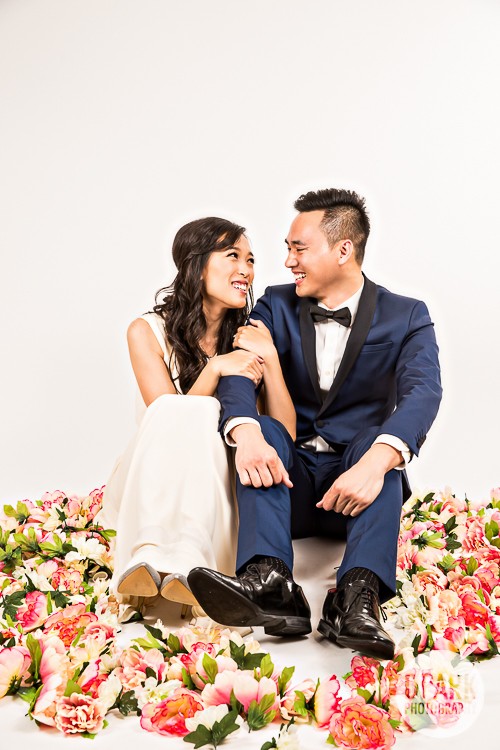
Find the location of `floor`. floor is located at coordinates (312, 747), (465, 738), (9, 734).